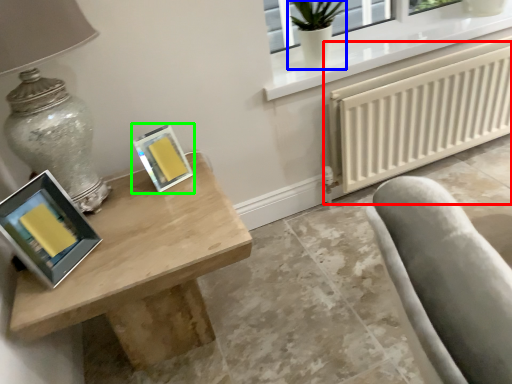
Question: Based on their relative distances, which object is farther from radiator (highlighted by a red box)? Choose from glass vase (highlighted by a blue box) and picture frame (highlighted by a green box).

Choices:
 (A) glass vase
 (B) picture frame

Answer: (B)